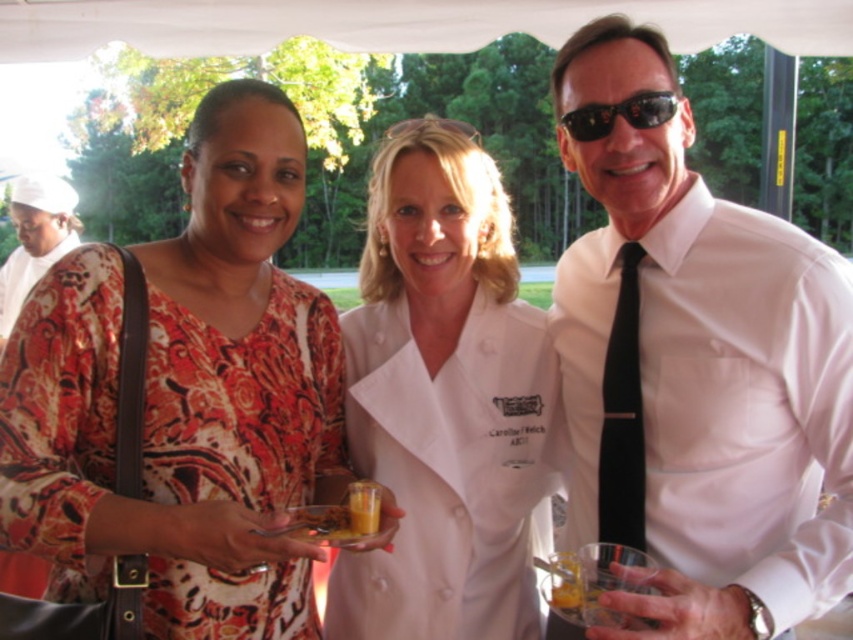
Looking at this image, you are a photographer at the event and want to take a photo of the printed silk blouse at center and the white chef coat at center. Which one will appear larger in the photo?

The printed silk blouse at center will appear larger in the photo because it is closer to the viewer than the white chef coat at center.

You are a photographer at the event and want to take a photo of the printed silk blouse at center. Based on its position coordinates, where should you aim your camera?

The printed silk blouse at center is located at coordinates point [181,403], so you should aim your camera at that position to capture it.

You are standing at the origin point of the coordinate system in the image. You want to move towards the printed silk blouse at center. Which direction should you move in terms of x and y coordinates?

The printed silk blouse at center is located at coordinates x 0.631 and y 0.213, so you should move in the positive x and positive y direction to reach it.